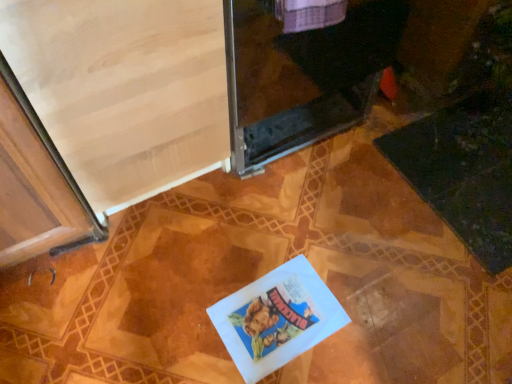
Question: Is transparent glass screen door at upper center, positioned as the second screen door in left-to-right order, to the right of light wood screen door at upper left, which appears as the second screen door when viewed from the right, from the viewer's perspective?

Choices:
 (A) no
 (B) yes

Answer: (B)

Question: Can you confirm if transparent glass screen door at upper center, positioned as the second screen door in left-to-right order, is shorter than light wood screen door at upper left, the first screen door positioned from the left?

Choices:
 (A) yes
 (B) no

Answer: (A)

Question: Is transparent glass screen door at upper center, the first screen door when ordered from right to left, next to light wood screen door at upper left, the first screen door positioned from the left, and touching it?

Choices:
 (A) no
 (B) yes

Answer: (A)

Question: From a real-world perspective, is transparent glass screen door at upper center, the first screen door when ordered from right to left, below light wood screen door at upper left, which appears as the second screen door when viewed from the right?

Choices:
 (A) no
 (B) yes

Answer: (B)

Question: Considering the relative sizes of transparent glass screen door at upper center, positioned as the second screen door in left-to-right order, and light wood screen door at upper left, the first screen door positioned from the left, in the image provided, is transparent glass screen door at upper center, positioned as the second screen door in left-to-right order, wider than light wood screen door at upper left, the first screen door positioned from the left,?

Choices:
 (A) no
 (B) yes

Answer: (B)

Question: From a real-world perspective, is transparent glass screen door at upper center, the first screen door when ordered from right to left, positioned over light wood screen door at upper left, the first screen door positioned from the left, based on gravity?

Choices:
 (A) no
 (B) yes

Answer: (A)

Question: Is light wood screen door at upper left, the first screen door positioned from the left, at the back of white paper book at center?

Choices:
 (A) no
 (B) yes

Answer: (B)

Question: Is white paper book at center completely or partially outside of light wood screen door at upper left, which appears as the second screen door when viewed from the right?

Choices:
 (A) yes
 (B) no

Answer: (A)

Question: From a real-world perspective, does white paper book at center stand above light wood screen door at upper left, which appears as the second screen door when viewed from the right?

Choices:
 (A) no
 (B) yes

Answer: (A)

Question: Can you confirm if white paper book at center is wider than light wood screen door at upper left, which appears as the second screen door when viewed from the right?

Choices:
 (A) yes
 (B) no

Answer: (B)

Question: Considering the relative positions of white paper book at center and light wood screen door at upper left, which appears as the second screen door when viewed from the right, in the image provided, is white paper book at center to the right of light wood screen door at upper left, which appears as the second screen door when viewed from the right, from the viewer's perspective?

Choices:
 (A) yes
 (B) no

Answer: (A)

Question: Can you confirm if white paper book at center is shorter than light wood screen door at upper left, the first screen door positioned from the left?

Choices:
 (A) yes
 (B) no

Answer: (A)

Question: Is light wood screen door at upper left, the first screen door positioned from the left, smaller than white paper book at center?

Choices:
 (A) no
 (B) yes

Answer: (A)